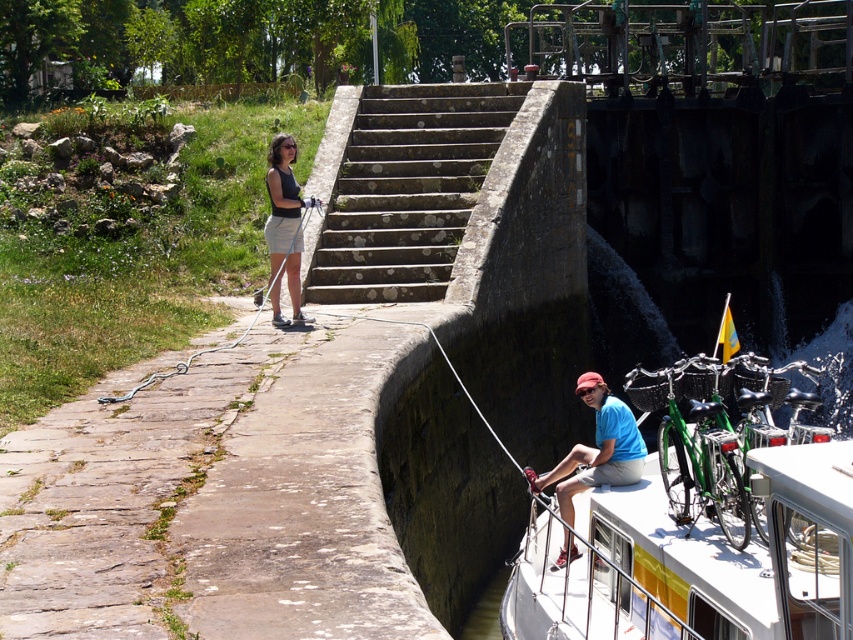
Question: Is the position of white glossy boat at lower right less distant than that of stone steps at center?

Choices:
 (A) no
 (B) yes

Answer: (B)

Question: Does white glossy boat at lower right appear over white rubber rope at left?

Choices:
 (A) no
 (B) yes

Answer: (A)

Question: Which of the following is the closest to the observer?

Choices:
 (A) (636, 428)
 (B) (444, 136)

Answer: (A)

Question: Which point is closer to the camera?

Choices:
 (A) blue cotton shirt at upper right
 (B) white glossy boat at lower right
 (C) stone steps at center
 (D) matte black tank top at center

Answer: (B)

Question: Is white glossy boat at lower right positioned in front of matte black tank top at center?

Choices:
 (A) no
 (B) yes

Answer: (B)

Question: Which point is farther to the camera?

Choices:
 (A) (637, 476)
 (B) (410, 209)
 (C) (262, 307)

Answer: (B)